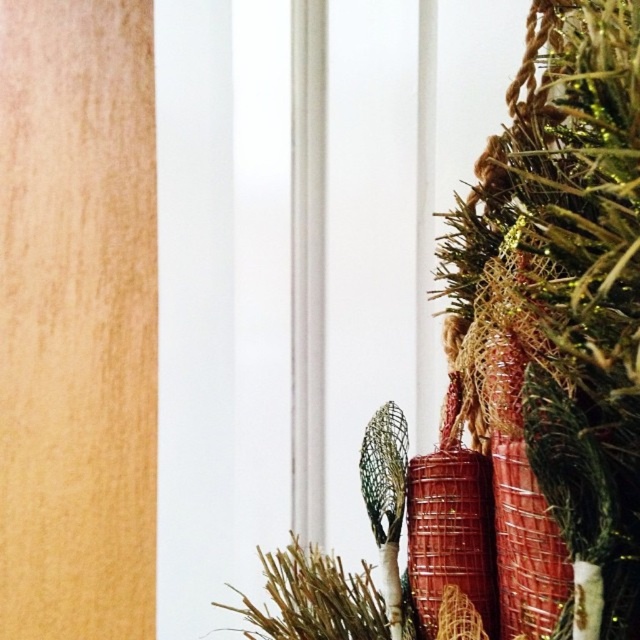
Is shiny metallic ornament at upper right shorter than shiny gold tinsel at right?

In fact, shiny metallic ornament at upper right may be taller than shiny gold tinsel at right.

Who is positioned more to the right, shiny metallic ornament at upper right or shiny gold tinsel at right?

shiny gold tinsel at right is more to the right.

Measure the distance between point (589,113) and camera.

Point (589,113) and camera are 17.96 inches apart from each other.

The width and height of the screenshot is (640, 640). What are the coordinates of `shiny metallic ornament at upper right` in the screenshot? It's located at (518, 376).